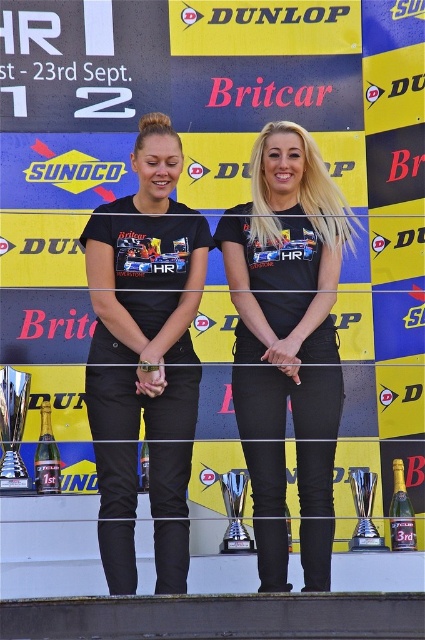
Question: Where is black matte t-shirt at center located in relation to shiny silver trophy at center in the image?

Choices:
 (A) left
 (B) right

Answer: (A)

Question: Estimate the real-world distances between objects in this image. Which object is closer to the shiny silver trophy at center?

Choices:
 (A) black matte t-shirt at center
 (B) black matte pants at center

Answer: (A)

Question: In this image, where is black matte pants at center located relative to shiny silver trophy at center?

Choices:
 (A) right
 (B) left

Answer: (B)

Question: Does black matte t-shirt at center appear on the left side of shiny silver trophy at center?

Choices:
 (A) no
 (B) yes

Answer: (B)

Question: Which object is farther from the camera taking this photo?

Choices:
 (A) black matte pants at center
 (B) shiny silver trophy at center
 (C) black matte t-shirt at center

Answer: (B)

Question: Which point is closer to the camera?

Choices:
 (A) (359, 520)
 (B) (325, 298)

Answer: (B)